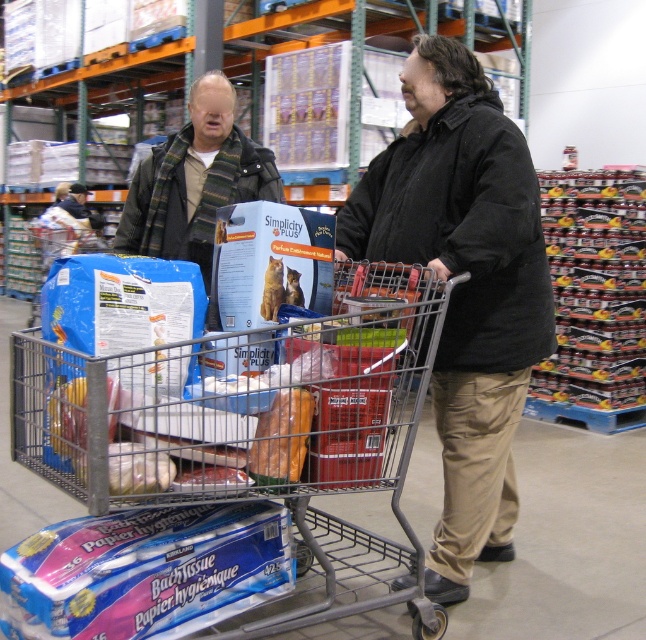
Consider the image. You are a store employee who needs to move a large box from the back storage area to the front of the store. The path between the storage and the front requires navigating through narrow aisles. Considering the metallic gray trolley at center and the black matte jacket at center, which object is wider and might pose a challenge when moving through tight spaces?

The metallic gray trolley at center is wider than the black matte jacket at center, so it may pose a challenge when moving through tight spaces due to its greater width.

You are standing in the warehouse store and need to move the metallic gray trolley at center to the exit, which is 10 feet away. Can you push the trolley the entire distance without needing to stop?

The metallic gray trolley at center is 5.12 feet away from the viewer. Since the exit is 10 feet away, the total distance to the exit would be 5.12 feet plus the additional distance needed to reach the exit. However, without knowing the exact layout or obstacles between the trolley and the exit, it is impossible to determine if you can push it the entire distance without stopping.

You are standing in the warehouse store and need to move the metallic gray trolley at center and the black matte jacket at center to the checkout counter. Which object should you move first if you want to reach the checkout counter first?

The metallic gray trolley at center is to the left of the black matte jacket at center. Since the checkout counter is likely in front of you, moving the metallic gray trolley at center first would allow you to reach the checkout counter first as it is positioned closer to your starting point on the left side.